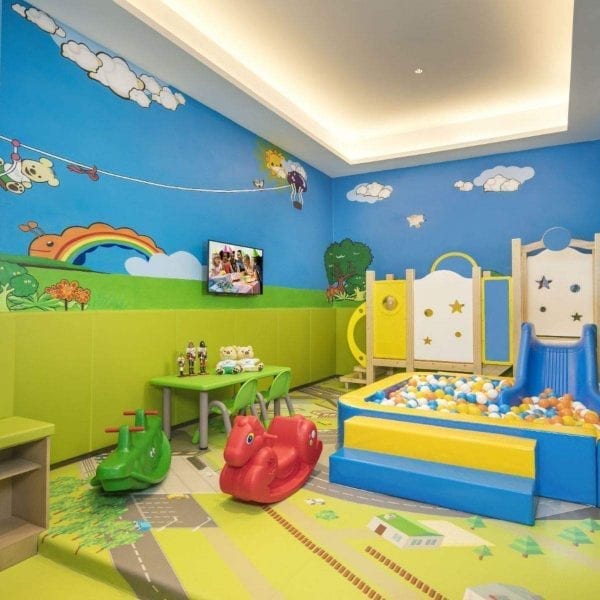
The height and width of the screenshot is (600, 600). Identify the location of trey ceiling. (410, 69), (398, 139).